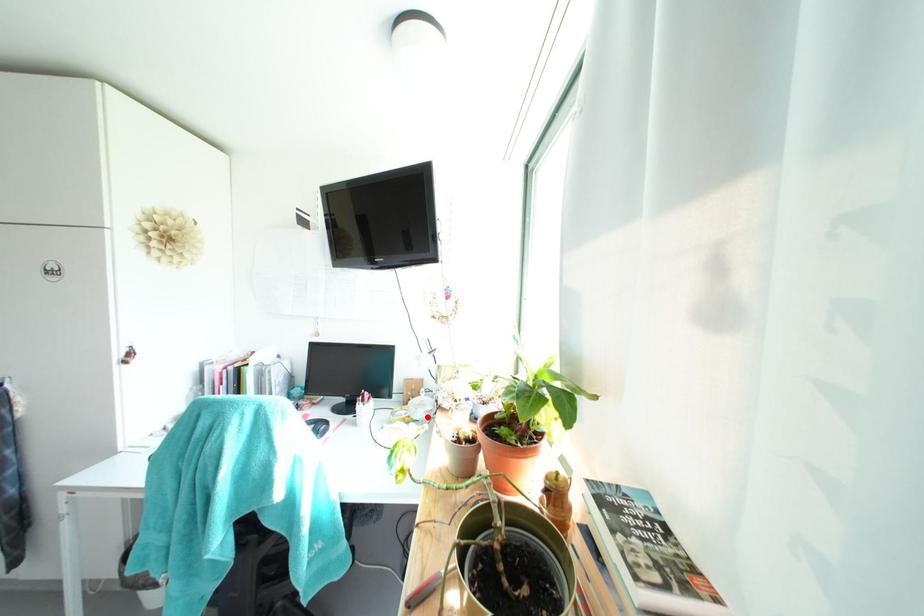
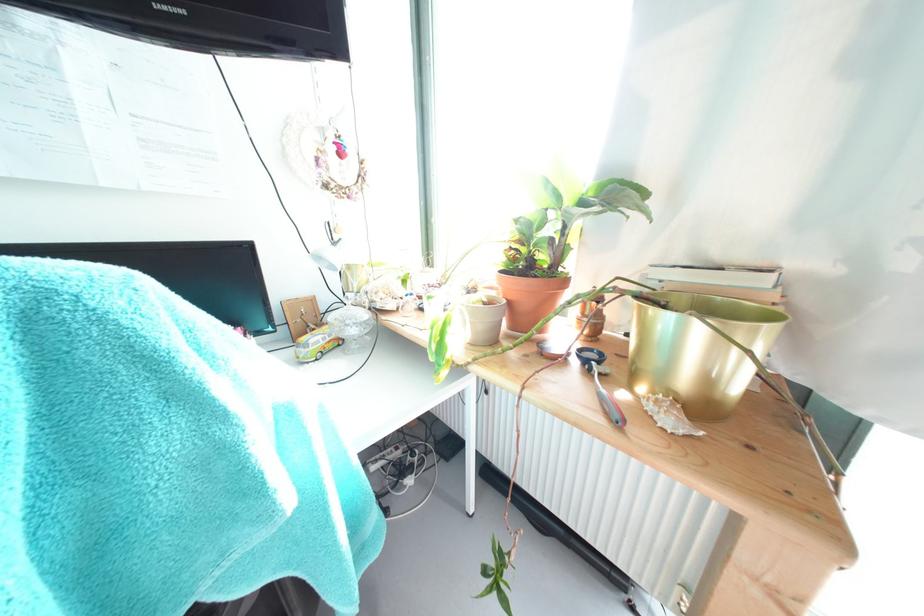
Find the pixel in the second image that matches the highlighted location in the first image.

(359, 333)